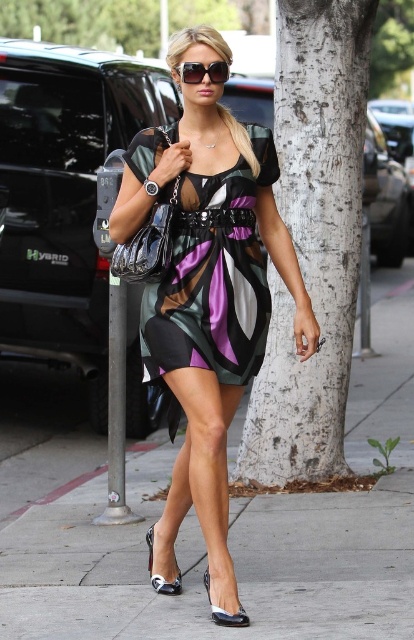
Question: Which point is farther to the camera?

Choices:
 (A) (158, 376)
 (B) (190, 74)
 (C) (209, 602)

Answer: (A)

Question: Which is farther from the shiny patent leather sandal at lower center?

Choices:
 (A) sunglasses at center
 (B) matte silk dress at center
 (C) shiny black sandal at lower center
 (D) matte multicolored dress at center

Answer: (A)

Question: Is white bark tree at center behind metallic gray pole at lower left?

Choices:
 (A) yes
 (B) no

Answer: (A)

Question: Does matte multicolored dress at center appear over white bark tree at center?

Choices:
 (A) no
 (B) yes

Answer: (A)

Question: Among these objects, which one is farthest from the camera?

Choices:
 (A) sunglasses at center
 (B) matte multicolored dress at center
 (C) white bark tree at upper center
 (D) shiny patent leather sandal at lower center

Answer: (C)

Question: Can you confirm if white bark tree at center is positioned above shiny patent leather sandal at lower center?

Choices:
 (A) yes
 (B) no

Answer: (A)